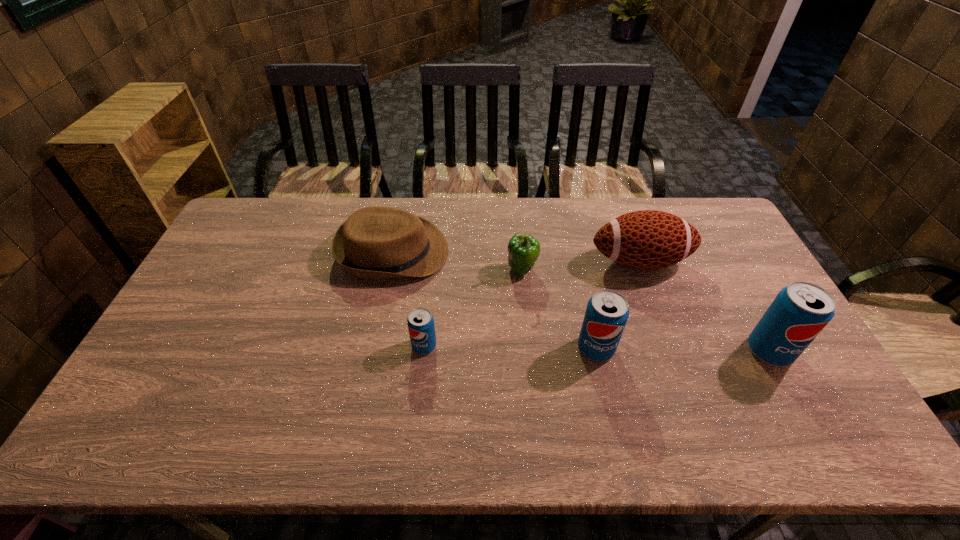
Identify the location of vacant place for an extra soda can on the left. point(254,343).